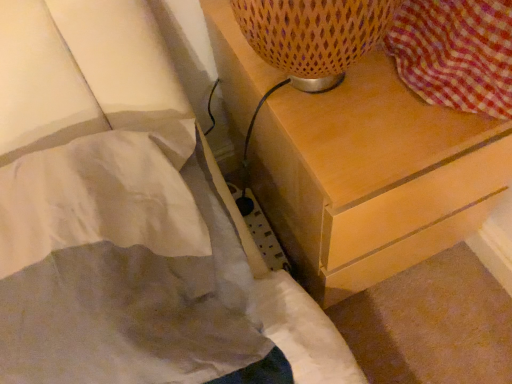
Question: From a real-world perspective, is white fabric bed at lower left above or below light brown wood chest of drawers at upper right?

Choices:
 (A) above
 (B) below

Answer: (A)

Question: Is white fabric bed at lower left wider or thinner than light brown wood chest of drawers at upper right?

Choices:
 (A) wide
 (B) thin

Answer: (B)

Question: Would you say white fabric bed at lower left is inside or outside light brown wood chest of drawers at upper right?

Choices:
 (A) inside
 (B) outside

Answer: (B)

Question: Visually, is light brown wood chest of drawers at upper right positioned to the left or to the right of white fabric bed at lower left?

Choices:
 (A) left
 (B) right

Answer: (B)

Question: Considering the positions of light brown wood chest of drawers at upper right and white fabric bed at lower left in the image, is light brown wood chest of drawers at upper right bigger or smaller than white fabric bed at lower left?

Choices:
 (A) big
 (B) small

Answer: (A)

Question: From a real-world perspective, is light brown wood chest of drawers at upper right physically located above or below white fabric bed at lower left?

Choices:
 (A) below
 (B) above

Answer: (A)

Question: From the image's perspective, is light brown wood chest of drawers at upper right located above or below white fabric bed at lower left?

Choices:
 (A) above
 (B) below

Answer: (A)